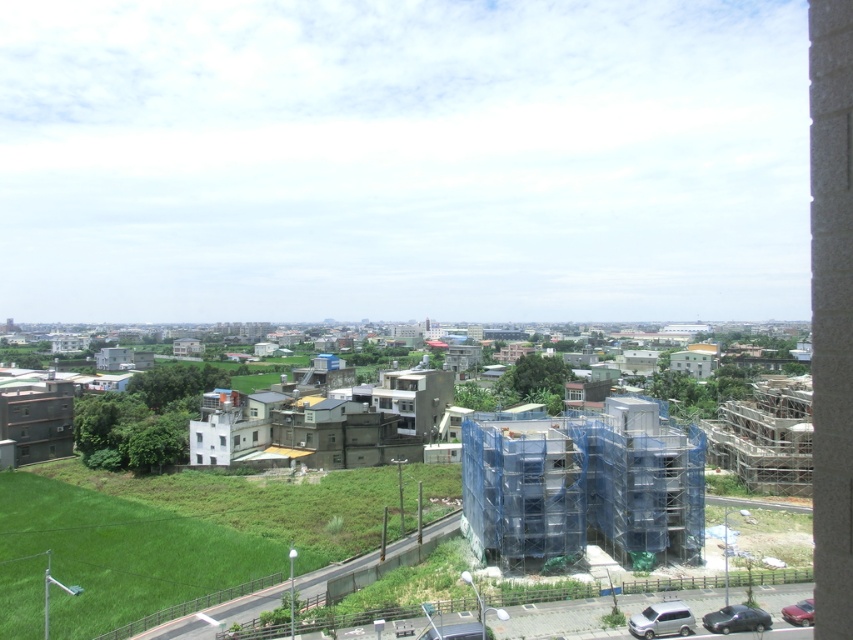
You are standing in the suburban area shown in the image. You notice two points marked in the scene. The first point is at coordinates point (x=502, y=484) and the second is at point (x=836, y=97). Which point is closer to your current position?

Point (x=502, y=484) is further to the camera than point (x=836, y=97). Therefore, the point closer to your current position is point (x=836, y=97).

You are a construction inspector assessing the site. You need to determine which of the two structures, the blue mesh scaffolding at center or the concrete block wall at right, is narrower in width. Which one is it?

The blue mesh scaffolding at center is thinner than the concrete block wall at right, so the blue mesh scaffolding at center is narrower in width.

From the picture: You are standing in the suburban area and want to take a photo of the blue mesh scaffolding at center and the concrete block wall at right. Which object should you focus on first to ensure it appears larger in your photo?

The blue mesh scaffolding at center is closer to you than the concrete block wall at right, so focusing on it first will make it appear larger in the photo.